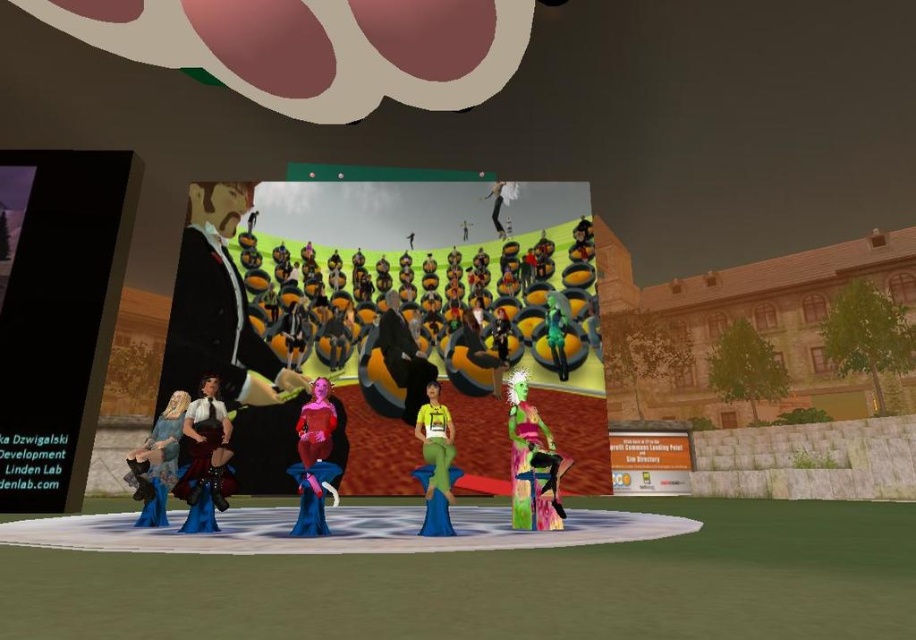
Question: Which object is closer to the camera taking this photo?

Choices:
 (A) shiny black dress at center
 (B) matte yellow shirt at center
 (C) velvet maroon dress at center

Answer: (B)

Question: Does shiny pink dress at center have a smaller size compared to shiny black pants at upper center?

Choices:
 (A) no
 (B) yes

Answer: (A)

Question: Among these objects, which one is farthest from the camera?

Choices:
 (A) velvet maroon dress at center
 (B) shiny pink dress at center

Answer: (A)

Question: Which of the following is the farthest from the observer?

Choices:
 (A) blue velvet dress at lower left
 (B) shiny black pants at upper center

Answer: (B)

Question: Does blue velvet dress at lower left appear under shiny pink dress at center?

Choices:
 (A) yes
 (B) no

Answer: (A)

Question: Is matte black suit at center above matte yellow shirt at center?

Choices:
 (A) yes
 (B) no

Answer: (A)